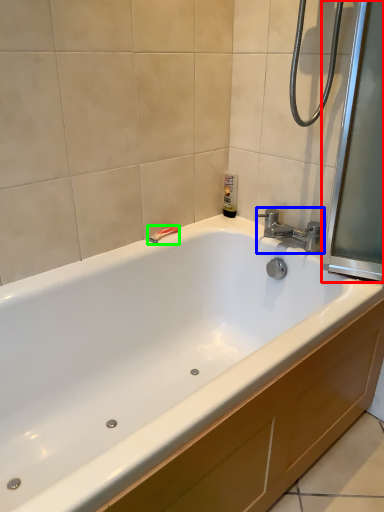
Question: Based on their relative distances, which object is farther from screen door (highlighted by a red box)? Choose from tap (highlighted by a blue box) and shower (highlighted by a green box).

Choices:
 (A) tap
 (B) shower

Answer: (B)